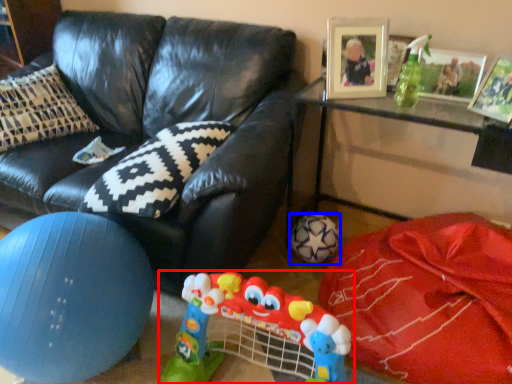
Question: Which point is further to the camera, toy (highlighted by a red box) or football (highlighted by a blue box)?

Choices:
 (A) toy
 (B) football

Answer: (B)